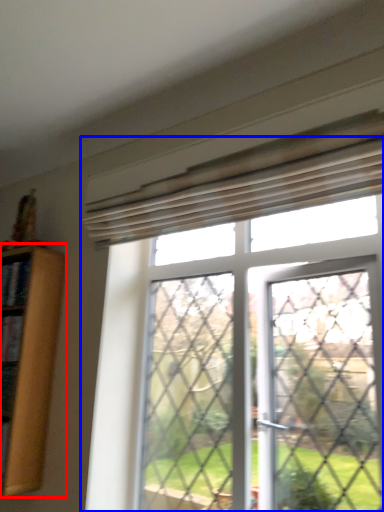
Question: Which of the following is the farthest to the observer, shelf (highlighted by a red box) or window (highlighted by a blue box)?

Choices:
 (A) shelf
 (B) window

Answer: (A)